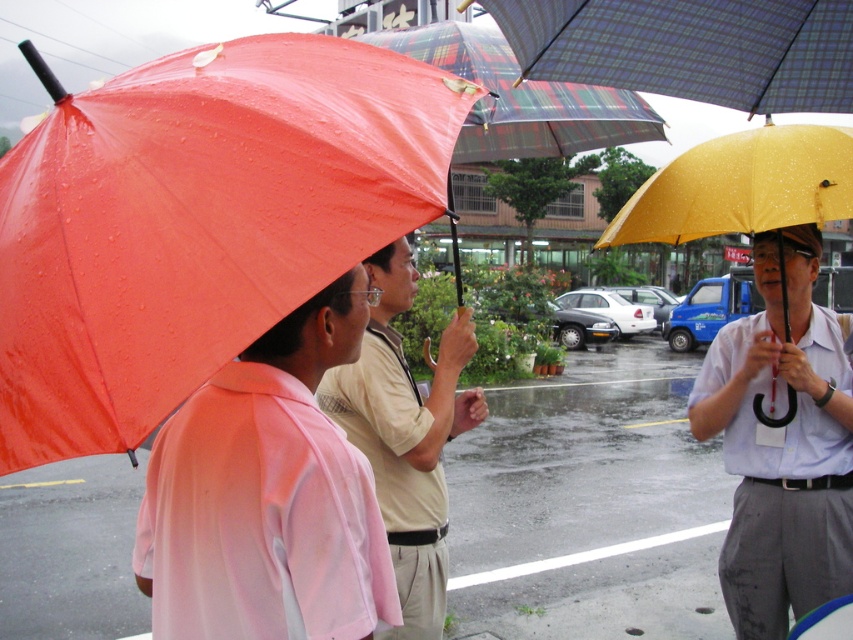
Between pink matte shirt at center and matte yellow umbrella at center, which one appears on the right side from the viewer's perspective?

matte yellow umbrella at center

Does point (151, 557) come farther from viewer compared to point (738, 552)?

No, it is in front of (738, 552).

Where is `pink matte shirt at center`? The image size is (853, 640). pink matte shirt at center is located at coordinates (267, 496).

Does shiny orange umbrella at left appear under matte beige shirt at center?

Incorrect, shiny orange umbrella at left is not positioned below matte beige shirt at center.

Which is behind, point (148, 285) or point (445, 376)?

The point (445, 376) is behind.

The image size is (853, 640). I want to click on shiny orange umbrella at left, so click(x=198, y=221).

Who is higher up, matte beige shirt at center or yellow matte umbrella at right?

yellow matte umbrella at right is above.

Which is more to the right, matte beige shirt at center or yellow matte umbrella at right?

yellow matte umbrella at right

Is point (378, 458) closer to viewer compared to point (679, 196)?

That is True.

Locate an element on the screen. This screenshot has width=853, height=640. matte beige shirt at center is located at coordinates (405, 436).